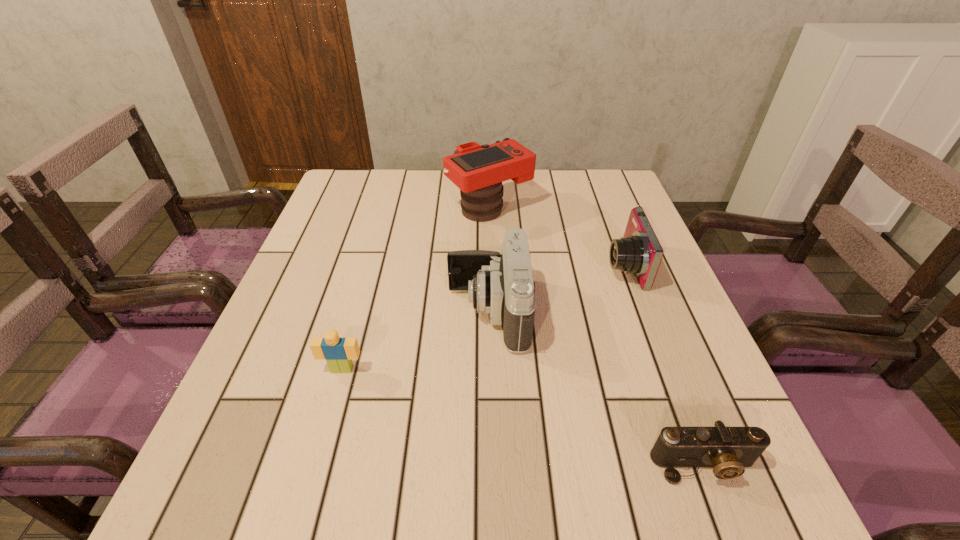
Find the location of a particular element. This screenshot has width=960, height=540. the farthest camera is located at coordinates (478, 171).

Where is `the third tallest camera`? Image resolution: width=960 pixels, height=540 pixels. the third tallest camera is located at coordinates (639, 252).

Where is `the leftmost object`? the leftmost object is located at coordinates (339, 352).

This screenshot has width=960, height=540. Find the location of `Lego`. Lego is located at coordinates (339, 352).

You are a GUI agent. You are given a task and a screenshot of the screen. Output one action in this format:
    pyautogui.click(x=<x>, y=<y>)
    Task: Click on the nearest object
    This screenshot has width=960, height=540.
    Given the screenshot: What is the action you would take?
    (728, 449)

The height and width of the screenshot is (540, 960). Find the location of `the shortest camera`. the shortest camera is located at coordinates (728, 449).

At what (x,y) coordinates should I click in order to perform the action: click on free space located on the right of the farthest camera. Please return your answer as a coordinate pair (x, y). The height and width of the screenshot is (540, 960). Looking at the image, I should click on (604, 208).

Identify the location of free region located 0.290m on the front-facing side of the third tallest camera. Image resolution: width=960 pixels, height=540 pixels. (483, 266).

Find the location of a particular element. The width and height of the screenshot is (960, 540). free spot located 0.330m on the front-facing side of the third tallest camera is located at coordinates (466, 266).

At what (x,y) coordinates should I click in order to perform the action: click on vacant space located on the front-facing side of the third tallest camera. Please return your answer as a coordinate pair (x, y). This screenshot has height=540, width=960. Looking at the image, I should click on (513, 266).